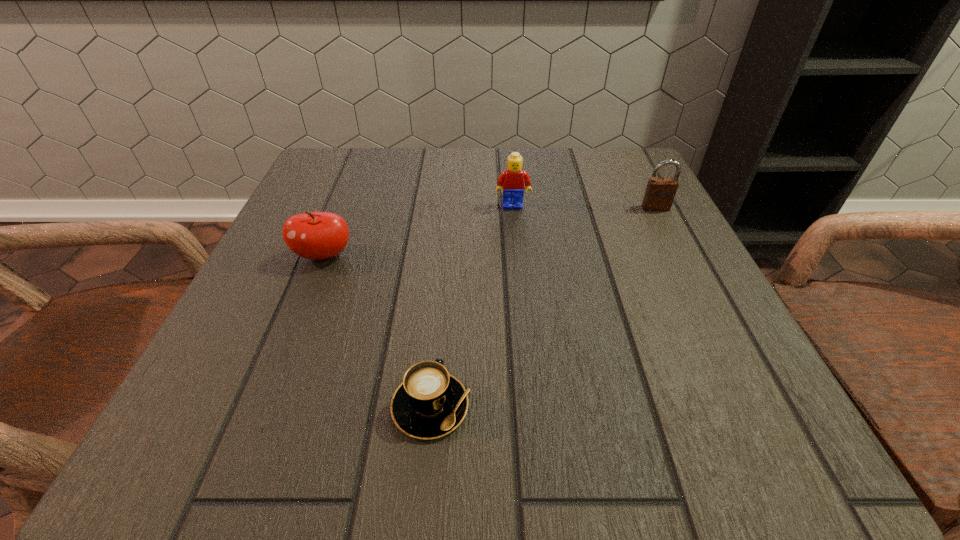
This screenshot has height=540, width=960. What are the coordinates of `free space at the near right corner of the desktop` in the screenshot? It's located at (684, 444).

This screenshot has height=540, width=960. What are the coordinates of `unoccupied area between the Lego and the second object from left to right` in the screenshot? It's located at (471, 306).

Locate an element on the screen. The width and height of the screenshot is (960, 540). unoccupied position between the third object from left to right and the rightmost object is located at coordinates (584, 207).

This screenshot has width=960, height=540. Find the location of `empty space between the Lego and the apple`. empty space between the Lego and the apple is located at coordinates (x=419, y=231).

This screenshot has width=960, height=540. In order to click on free space between the rightmost object and the Lego in this screenshot , I will do point(584,207).

Image resolution: width=960 pixels, height=540 pixels. I want to click on blank region between the rightmost object and the second nearest object, so click(x=490, y=232).

Identify the location of free point between the rightmost object and the leftmost object. This screenshot has height=540, width=960. (490, 232).

Where is `vacant space that's between the third object from left to right and the apple`? vacant space that's between the third object from left to right and the apple is located at coordinates (419, 231).

Image resolution: width=960 pixels, height=540 pixels. Identify the location of free space between the leftmost object and the Lego. (419, 231).

Identify the location of vacant area between the padlock and the cappuccino. The height and width of the screenshot is (540, 960). (543, 307).